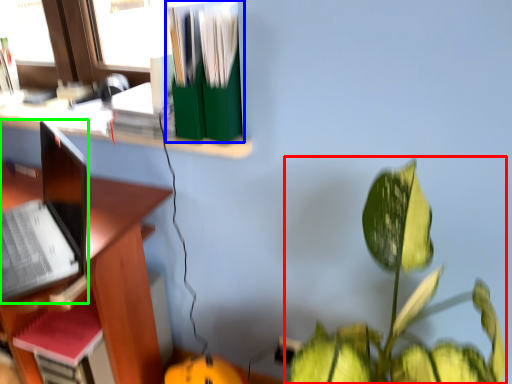
Question: Estimate the real-world distances between objects in this image. Which object is closer to houseplant (highlighted by a red box), book (highlighted by a blue box) or laptop (highlighted by a green box)?

Choices:
 (A) book
 (B) laptop

Answer: (A)